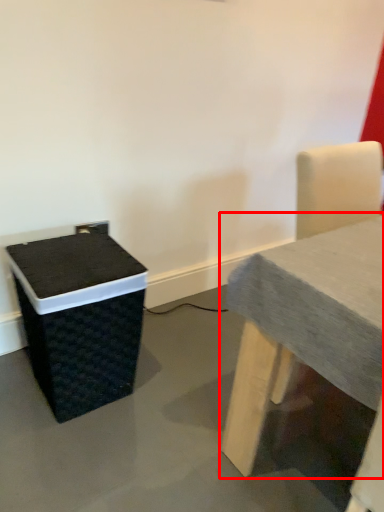
Question: From the image's perspective, what is the correct spatial relationship of table (annotated by the red box) in relation to recycling bin?

Choices:
 (A) below
 (B) above

Answer: (B)